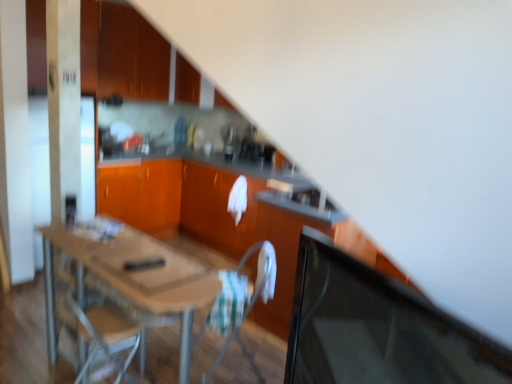
This screenshot has height=384, width=512. What do you see at coordinates (131, 55) in the screenshot? I see `matte wood cabinets at upper left, acting as the 1th cabinetry starting from the top` at bounding box center [131, 55].

Measure the distance between wooden table at center and camera.

wooden table at center is 3.59 meters from camera.

Find the location of a particular element. black glossy computer monitor at right is located at coordinates (377, 329).

The width and height of the screenshot is (512, 384). Identify the location of wooden table at center. (134, 279).

Describe the element at coordinates (260, 272) in the screenshot. The image size is (512, 384). I see `white fabric chair at center` at that location.

I want to click on orange glossy cabinets at center, which appears as the first cabinetry when ordered from the bottom, so click(x=178, y=201).

Image resolution: width=512 pixels, height=384 pixels. Identify the location of matte wood cabinets at upper left, acting as the 1th cabinetry starting from the top. (131, 55).

Is matte wood cabinets at upper left, positioned as the 2th cabinetry in bottom-to-top order, positioned beyond the bounds of wooden table at center?

Yes, matte wood cabinets at upper left, positioned as the 2th cabinetry in bottom-to-top order, is not within wooden table at center.

From the image's perspective, which is below, matte wood cabinets at upper left, positioned as the 2th cabinetry in bottom-to-top order, or wooden table at center?

wooden table at center.

From the wooden table at center, count the 2nd cabinetry to the left and point to it. Please provide its 2D coordinates.

[(131, 55)]

Is matte wood cabinets at upper left, positioned as the 2th cabinetry in bottom-to-top order, positioned in front of wooden table at center?

No, the depth of matte wood cabinets at upper left, positioned as the 2th cabinetry in bottom-to-top order, is greater than that of wooden table at center.

Identify the location of chair that appears below the black glossy computer monitor at right (from the image's perspective). (260, 272).

Which of these two, black glossy computer monitor at right or white fabric chair at center, stands shorter?

black glossy computer monitor at right.

Would you say white fabric chair at center is inside or outside orange glossy cabinets at center, which appears as the first cabinetry when ordered from the bottom?

white fabric chair at center is not inside orange glossy cabinets at center, which appears as the first cabinetry when ordered from the bottom, it's outside.

Is white fabric chair at center turned away from orange glossy cabinets at center, which appears as the first cabinetry when ordered from the bottom?

white fabric chair at center is not turned away from orange glossy cabinets at center, which appears as the first cabinetry when ordered from the bottom.

From a real-world perspective, is white fabric chair at center positioned above or below orange glossy cabinets at center, which ranks as the second cabinetry in top-to-bottom order?

Clearly, from a real-world perspective, white fabric chair at center is below orange glossy cabinets at center, which ranks as the second cabinetry in top-to-bottom order.

Can you confirm if white fabric chair at center is bigger than orange glossy cabinets at center, which ranks as the second cabinetry in top-to-bottom order?

Incorrect, white fabric chair at center is not larger than orange glossy cabinets at center, which ranks as the second cabinetry in top-to-bottom order.

Would you say black glossy computer monitor at right is outside orange glossy cabinets at center, which appears as the first cabinetry when ordered from the bottom?

Yes, black glossy computer monitor at right is outside of orange glossy cabinets at center, which appears as the first cabinetry when ordered from the bottom.

What are the coordinates of `the 1st cabinetry above the black glossy computer monitor at right (from the image's perspective)` in the screenshot? It's located at point(178,201).

From a real-world perspective, is black glossy computer monitor at right below orange glossy cabinets at center, which appears as the first cabinetry when ordered from the bottom?

No, from a real-world perspective, black glossy computer monitor at right is not under orange glossy cabinets at center, which appears as the first cabinetry when ordered from the bottom.

Is orange glossy cabinets at center, which appears as the first cabinetry when ordered from the bottom, surrounding white fabric chair at center?

No, white fabric chair at center is not surrounded by orange glossy cabinets at center, which appears as the first cabinetry when ordered from the bottom.

Considering the points (254, 213) and (217, 357), which point is behind, point (254, 213) or point (217, 357)?

Positioned behind is point (254, 213).

Does orange glossy cabinets at center, which ranks as the second cabinetry in top-to-bottom order, have a greater width compared to white fabric chair at center?

Yes, orange glossy cabinets at center, which ranks as the second cabinetry in top-to-bottom order, is wider than white fabric chair at center.

In the scene shown: Which is in front, white fabric chair at center or matte wood cabinets at upper left, acting as the 1th cabinetry starting from the top?

white fabric chair at center.

Identify the location of chair that appears on the right of matte wood cabinets at upper left, acting as the 1th cabinetry starting from the top. The width and height of the screenshot is (512, 384). (260, 272).

Does white fabric chair at center have a lesser width compared to matte wood cabinets at upper left, acting as the 1th cabinetry starting from the top?

No.

Considering the relative sizes of white fabric chair at center and matte wood cabinets at upper left, positioned as the 2th cabinetry in bottom-to-top order, in the image provided, is white fabric chair at center taller than matte wood cabinets at upper left, positioned as the 2th cabinetry in bottom-to-top order,?

No, white fabric chair at center is not taller than matte wood cabinets at upper left, positioned as the 2th cabinetry in bottom-to-top order.

Is matte wood cabinets at upper left, positioned as the 2th cabinetry in bottom-to-top order, bigger than orange glossy cabinets at center, which ranks as the second cabinetry in top-to-bottom order?

Actually, matte wood cabinets at upper left, positioned as the 2th cabinetry in bottom-to-top order, might be smaller than orange glossy cabinets at center, which ranks as the second cabinetry in top-to-bottom order.

From a real-world perspective, which object stands above the other?

In real-world perspective, matte wood cabinets at upper left, positioned as the 2th cabinetry in bottom-to-top order, is above.

What's the angular difference between matte wood cabinets at upper left, positioned as the 2th cabinetry in bottom-to-top order, and orange glossy cabinets at center, which ranks as the second cabinetry in top-to-bottom order,'s facing directions?

They differ by 0.709 degrees in their facing directions.

From the image's perspective, who appears lower, matte wood cabinets at upper left, acting as the 1th cabinetry starting from the top, or orange glossy cabinets at center, which appears as the first cabinetry when ordered from the bottom?

orange glossy cabinets at center, which appears as the first cabinetry when ordered from the bottom, is shown below in the image.

Where is `computer desk in front of the matte wood cabinets at upper left, acting as the 1th cabinetry starting from the top`? This screenshot has width=512, height=384. computer desk in front of the matte wood cabinets at upper left, acting as the 1th cabinetry starting from the top is located at coordinates (208, 217).

Locate an element on the screen. This screenshot has width=512, height=384. computer monitor to the right of white fabric chair at center is located at coordinates (377, 329).

When comparing their distances from orange glossy cabinets at center, which ranks as the second cabinetry in top-to-bottom order, does wooden table at center or matte wood cabinets at upper left, acting as the 1th cabinetry starting from the top, seem further?

The object further to orange glossy cabinets at center, which ranks as the second cabinetry in top-to-bottom order, is matte wood cabinets at upper left, acting as the 1th cabinetry starting from the top.

From the image, which object appears to be nearer to white fabric chair at center, matte wood cabinets at upper left, acting as the 1th cabinetry starting from the top, or black glossy computer monitor at right?

Based on the image, black glossy computer monitor at right appears to be nearer to white fabric chair at center.

Looking at the image, which one is located closer to black glossy computer monitor at right, wooden table at center or wooden table at center?

The object closer to black glossy computer monitor at right is wooden table at center.

When comparing their distances from orange glossy cabinets at center, which ranks as the second cabinetry in top-to-bottom order, does wooden table at center or black glossy computer monitor at right seem closer?

black glossy computer monitor at right lies closer to orange glossy cabinets at center, which ranks as the second cabinetry in top-to-bottom order, than the other object.

Which object lies nearer to the anchor point wooden table at center, wooden table at center or white fabric chair at center?

white fabric chair at center lies closer to wooden table at center than the other object.

Looking at the image, which one is located closer to matte wood cabinets at upper left, acting as the 1th cabinetry starting from the top, wooden table at center or orange glossy cabinets at center, which appears as the first cabinetry when ordered from the bottom?

Based on the image, wooden table at center appears to be nearer to matte wood cabinets at upper left, acting as the 1th cabinetry starting from the top.

When comparing their distances from matte wood cabinets at upper left, positioned as the 2th cabinetry in bottom-to-top order, does wooden table at center or black glossy computer monitor at right seem further?

black glossy computer monitor at right is further to matte wood cabinets at upper left, positioned as the 2th cabinetry in bottom-to-top order.

Based on their spatial positions, is white fabric chair at center or wooden table at center further from orange glossy cabinets at center, which ranks as the second cabinetry in top-to-bottom order?

white fabric chair at center.

Find the location of a particular element. chair located between black glossy computer monitor at right and orange glossy cabinets at center, which appears as the first cabinetry when ordered from the bottom, in the depth direction is located at coordinates (260, 272).

In order to click on chair between black glossy computer monitor at right and matte wood cabinets at upper left, positioned as the 2th cabinetry in bottom-to-top order, in the front-back direction in this screenshot , I will do [x=260, y=272].

I want to click on computer desk between black glossy computer monitor at right and matte wood cabinets at upper left, positioned as the 2th cabinetry in bottom-to-top order, from front to back, so click(208, 217).

This screenshot has width=512, height=384. I want to click on chair between black glossy computer monitor at right and wooden table at center from front to back, so point(260,272).